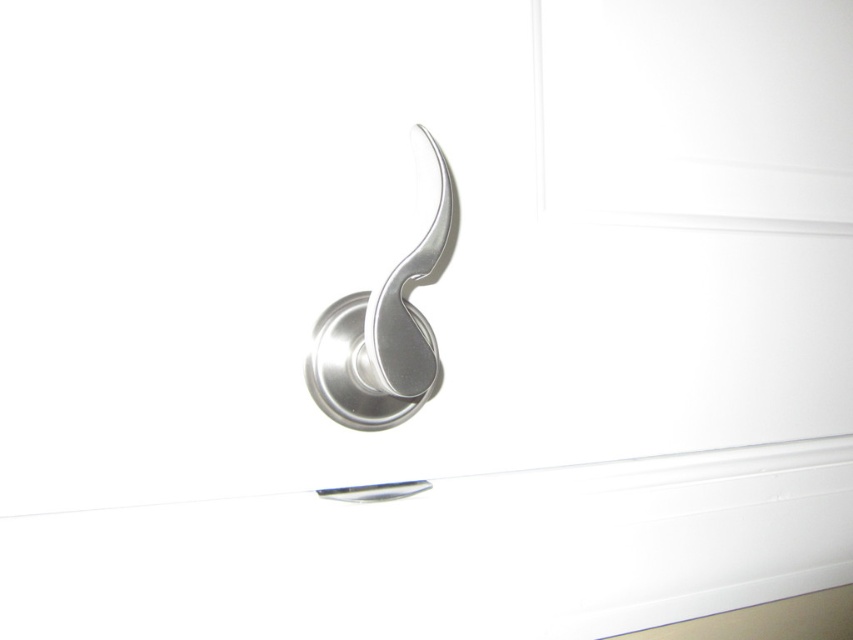
You are holding a 12 inch ruler and want to measure the distance from the camera to the point marked at coordinates point (595, 634). Can you reach it with your ruler?

The point marked at coordinates point (595, 634) is 17.25 inches away from the camera, so the 12 inch ruler is not long enough to reach it.

You are holding a camera and want to take a close up photo of the satin silver handle at center. The camera requires a minimum distance of 12 inches to focus properly. Can you take the photo without moving closer than the current distance?

The satin silver handle at center and camera are 12.51 inches apart, which is just over the required 12 inches minimum distance. Therefore, you can take the photo without moving closer.